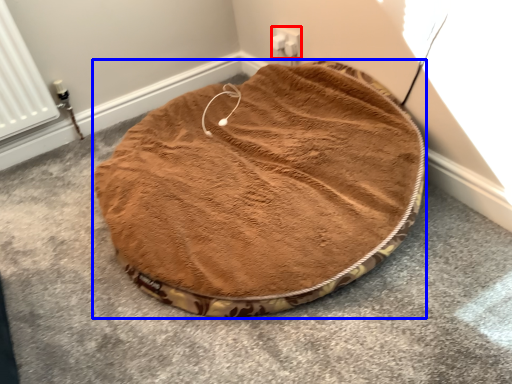
Question: Which object appears closest to the camera in this image, electric outlet (highlighted by a red box) or dog bed (highlighted by a blue box)?

Choices:
 (A) electric outlet
 (B) dog bed

Answer: (B)